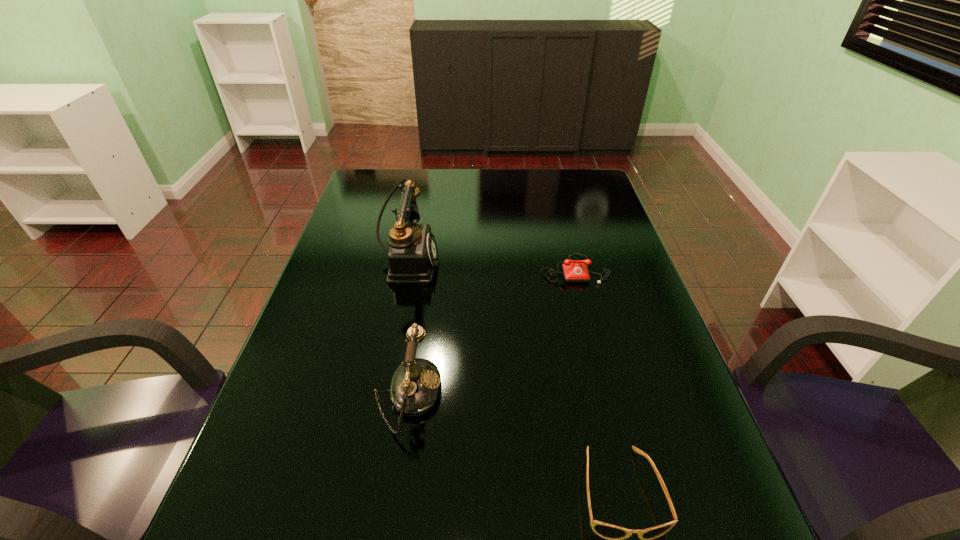
This screenshot has height=540, width=960. In the image, there is a desktop. In order to click on free space at the left edge in this screenshot , I will do `click(336, 241)`.

In the image, there is a desktop. At what (x,y) coordinates should I click in order to perform the action: click on free space at the right edge. Please return your answer as a coordinate pair (x, y). This screenshot has width=960, height=540. Looking at the image, I should click on (581, 246).

In the image, there is a desktop. Identify the location of vacant space at the far right corner. (558, 189).

The height and width of the screenshot is (540, 960). What are the coordinates of `blank region between the rightmost telephone and the tallest object` in the screenshot? It's located at (491, 266).

At what (x,y) coordinates should I click in order to perform the action: click on vacant region between the second nearest object and the tallest telephone. Please return your answer as a coordinate pair (x, y). The width and height of the screenshot is (960, 540). Looking at the image, I should click on click(407, 329).

Identify the location of unoccupied position between the shortest telephone and the second tallest telephone. (491, 332).

Locate an element on the screen. vacant region between the second tallest telephone and the tallest object is located at coordinates (407, 329).

Identify the location of free area in between the tallest telephone and the shortest telephone. Image resolution: width=960 pixels, height=540 pixels. (491, 266).

I want to click on free point between the second shortest telephone and the rightmost telephone, so click(x=491, y=332).

Identify the location of object that is the third closest one to the tallest object. (615, 534).